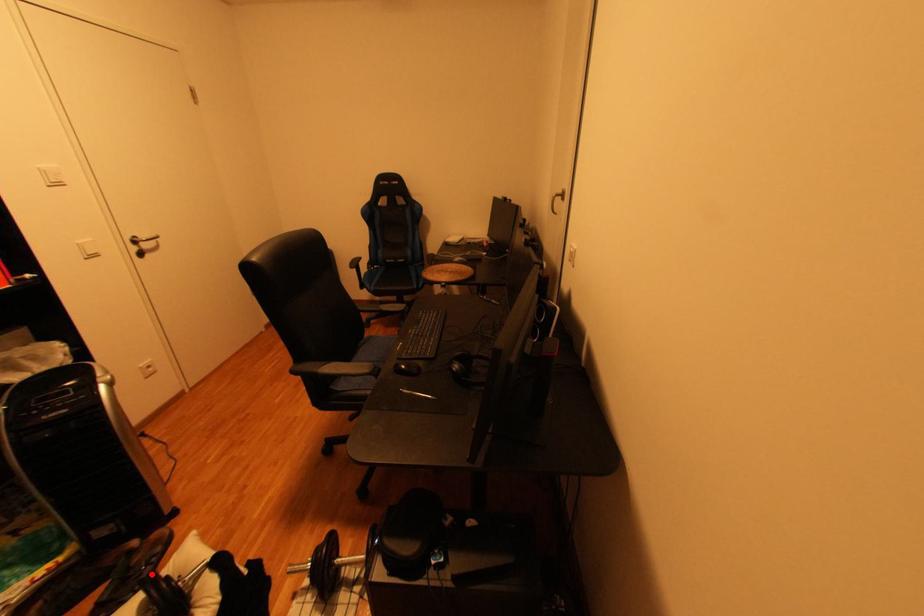
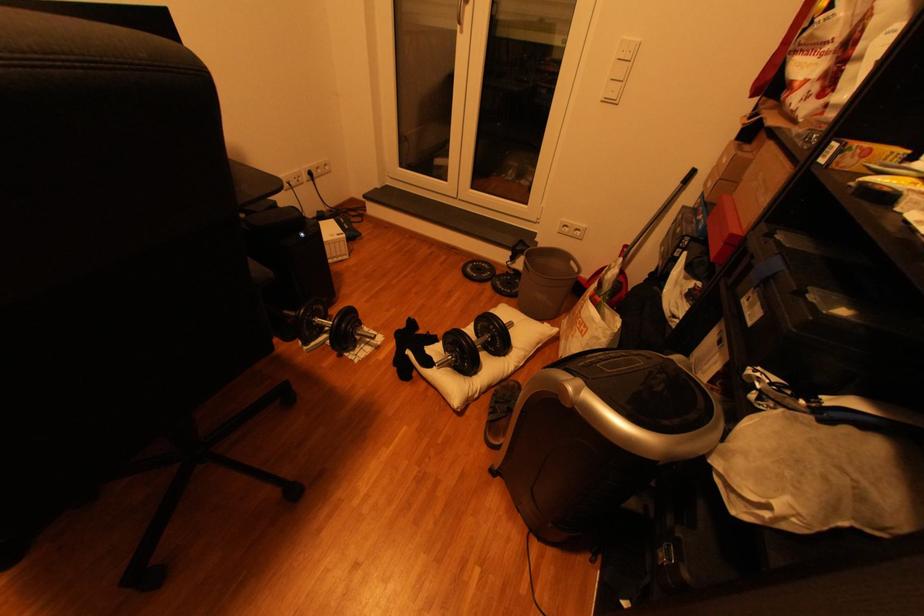
In the second image, find the point that corresponds to the highlighted location in the first image.

(505, 402)